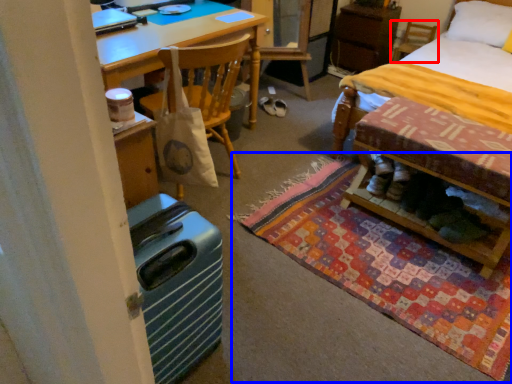
Question: Which object is further to the camera taking this photo, chair (highlighted by a red box) or mat (highlighted by a blue box)?

Choices:
 (A) chair
 (B) mat

Answer: (A)